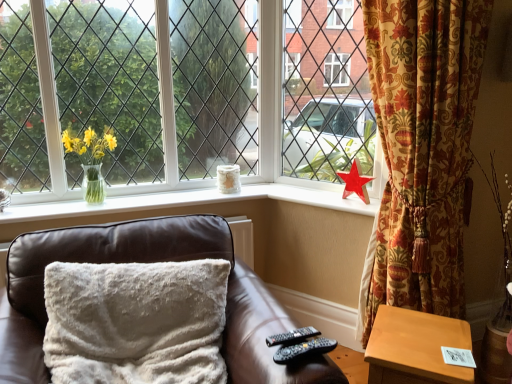
What are the coordinates of `free space to the left of matte glass vase at upper center, which ranks as the first daffodil in right-to-left order` in the screenshot? It's located at (326, 193).